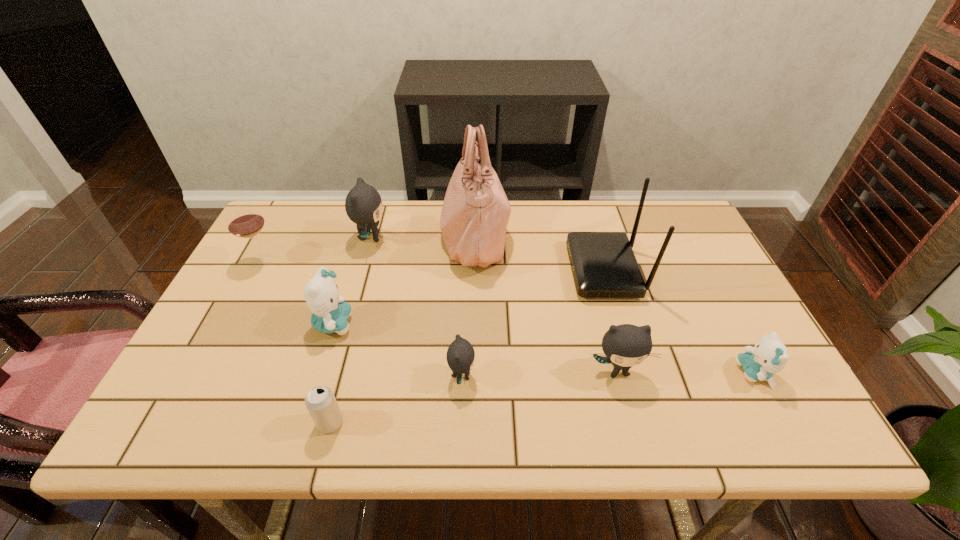
Where is `vacant space at the far right corner`? vacant space at the far right corner is located at coordinates (666, 223).

You are a GUI agent. You are given a task and a screenshot of the screen. Output one action in this format:
    pyautogui.click(x=<x>, y=<y>)
    Task: Click on the free space between the farthest kitten and the beer can
    This screenshot has height=540, width=960.
    Given the screenshot: What is the action you would take?
    pyautogui.click(x=350, y=330)

Where is `free space that is in between the eighth shortest object and the nearer blue kitten`? Image resolution: width=960 pixels, height=540 pixels. free space that is in between the eighth shortest object and the nearer blue kitten is located at coordinates (680, 322).

This screenshot has height=540, width=960. I want to click on vacant space that is in between the router and the smallest gray kitten, so click(x=534, y=323).

Locate an element on the screen. The height and width of the screenshot is (540, 960). free space between the red wineglass and the handbag is located at coordinates (369, 248).

Identify the location of free point between the nearest object and the leftmost object. This screenshot has width=960, height=540. (297, 341).

Where is `unoccupied position between the left blue kitten and the beer can`? unoccupied position between the left blue kitten and the beer can is located at coordinates (332, 373).

Identify the location of free space that is in between the rightmost kitten and the router. (680, 322).

Find the location of a particular element. This screenshot has height=540, width=960. vacant space that's between the second kitten from right to left and the fifth nearest object is located at coordinates pyautogui.click(x=475, y=347).

Identify the location of vacant area that lies between the farthest gray kitten and the second smallest gray kitten. Image resolution: width=960 pixels, height=540 pixels. (494, 305).